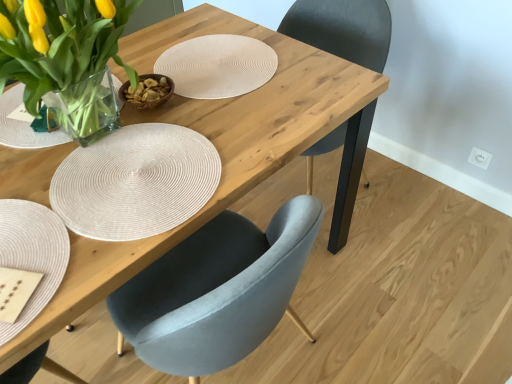
The image size is (512, 384). What do you see at coordinates (32, 254) in the screenshot?
I see `beige woven placemat at lower left` at bounding box center [32, 254].

This screenshot has width=512, height=384. Describe the element at coordinates (343, 29) in the screenshot. I see `matte gray chair at center` at that location.

Image resolution: width=512 pixels, height=384 pixels. I want to click on clear glass vase at upper left, so click(65, 56).

This screenshot has height=384, width=512. Identify the location of beige woven placemat at lower left. (32, 254).

Does beige woven placemat at lower left have a larger size compared to clear glass vase at upper left?

Incorrect, beige woven placemat at lower left is not larger than clear glass vase at upper left.

Which object is more forward, beige woven placemat at lower left or clear glass vase at upper left?

beige woven placemat at lower left is closer to the camera.

From a real-world perspective, relative to clear glass vase at upper left, is beige woven placemat at lower left vertically above or below?

From a real-world perspective, beige woven placemat at lower left is physically below clear glass vase at upper left.

From the picture: Considering the sizes of beige woven placemat at lower left and matte gray chair at center in the image, is beige woven placemat at lower left bigger or smaller than matte gray chair at center?

Considering their sizes, beige woven placemat at lower left takes up less space than matte gray chair at center.

Is beige woven placemat at lower left positioned in front of matte gray chair at center?

Yes, beige woven placemat at lower left is in front of matte gray chair at center.

How different are the orientations of beige woven placemat at lower left and matte gray chair at center in degrees?

The facing directions of beige woven placemat at lower left and matte gray chair at center are 91.3 degrees apart.

Consider the image. Is beige woven placemat at lower left not close to matte gray chair at center?

Yes.

Is clear glass vase at upper left positioned with its back to matte gray chair at center?

No, matte gray chair at center is not at the back of clear glass vase at upper left.

Between clear glass vase at upper left and matte gray chair at center, which one has larger size?

Bigger between the two is matte gray chair at center.

Is clear glass vase at upper left located outside matte gray chair at center?

Indeed, clear glass vase at upper left is completely outside matte gray chair at center.

From the picture: Considering their positions, is clear glass vase at upper left located in front of or behind matte gray chair at center?

In the image, clear glass vase at upper left appears in front of matte gray chair at center.

Is point (362, 161) more distant than point (40, 282)?

Yes, it is.

Does matte gray chair at center have a smaller size compared to beige woven placemat at lower left?

Incorrect, matte gray chair at center is not smaller in size than beige woven placemat at lower left.

Can beige woven placemat at lower left be found inside matte gray chair at center?

No.

Is clear glass vase at upper left facing towards beige woven placemat at lower left?

No.

Is clear glass vase at upper left completely or partially outside of beige woven placemat at lower left?

Yes, clear glass vase at upper left is outside of beige woven placemat at lower left.

Considering the sizes of clear glass vase at upper left and beige woven placemat at lower left in the image, is clear glass vase at upper left bigger or smaller than beige woven placemat at lower left?

Clearly, clear glass vase at upper left is larger in size than beige woven placemat at lower left.

Is matte gray chair at center spatially inside clear glass vase at upper left, or outside of it?

matte gray chair at center lies outside clear glass vase at upper left.

From a real-world perspective, is matte gray chair at center positioned above or below clear glass vase at upper left?

matte gray chair at center is situated lower than clear glass vase at upper left in the real world.

In terms of width, does matte gray chair at center look wider or thinner when compared to clear glass vase at upper left?

In the image, matte gray chair at center appears to be wider than clear glass vase at upper left.

Is matte gray chair at center aimed at clear glass vase at upper left?

Yes.

The image size is (512, 384). Find the location of `floral arrangement above the beige woven placemat at lower left (from the image's perspective)`. floral arrangement above the beige woven placemat at lower left (from the image's perspective) is located at coordinates (x=65, y=56).

In order to click on chair on the right of the beige woven placemat at lower left in this screenshot , I will do `click(343, 29)`.

Looking at the image, which one is located closer to clear glass vase at upper left, matte gray chair at center or beige woven placemat at lower left?

Among the two, beige woven placemat at lower left is located nearer to clear glass vase at upper left.

Estimate the real-world distances between objects in this image. Which object is closer to matte gray chair at center, beige woven placemat at lower left or clear glass vase at upper left?

Among the two, clear glass vase at upper left is located nearer to matte gray chair at center.

Based on their spatial positions, is clear glass vase at upper left or beige woven placemat at lower left closer to matte gray chair at center?

Among the two, clear glass vase at upper left is located nearer to matte gray chair at center.

From the image, which object appears to be farther from clear glass vase at upper left, beige woven placemat at lower left or matte gray chair at center?

Based on the image, matte gray chair at center appears to be further to clear glass vase at upper left.

Estimate the real-world distances between objects in this image. Which object is further from beige woven placemat at lower left, matte gray chair at center or clear glass vase at upper left?

matte gray chair at center is positioned further to the anchor beige woven placemat at lower left.

Based on their spatial positions, is clear glass vase at upper left or matte gray chair at center further from beige woven placemat at lower left?

matte gray chair at center.

Find the location of a particular element. The image size is (512, 384). floral arrangement between beige woven placemat at lower left and matte gray chair at center from left to right is located at coordinates (65, 56).